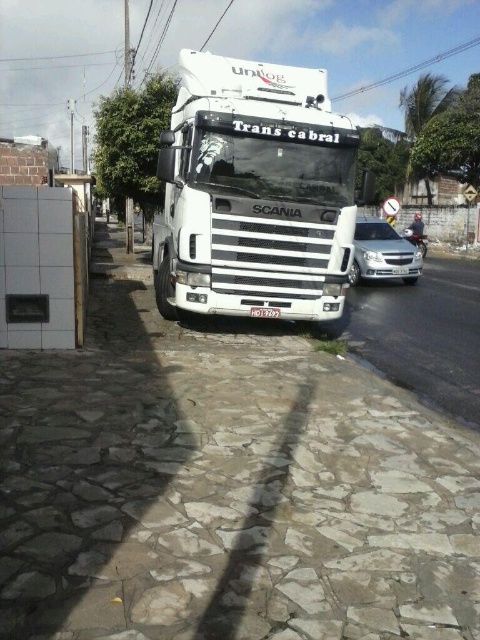
You are standing on the cobblestone sidewalk on the left side of the street. You want to cross the street to the paved road on the right. Is the white matte truck at center blocking your path directly in front of you?

The white matte truck at center is located at point (253,193), which means it is positioned in the foreground and directly in front of you on the street. Therefore, it is blocking your path directly in front of you.

You are a delivery driver who needs to park your 6.5 meter long truck behind the white matte truck at center. Is there enough space between your truck and the silver car behind it?

The distance between the white matte truck at center and the silver car behind it is 7.33 meters. Since your truck is 6.5 meters long, there is sufficient space to park your truck behind the white matte truck at center.

You are standing at the camera position looking at the street scene. Where is the white matte truck at center located in relation to the point marked at coordinates (x=253, y=193)?

The white matte truck at center is located exactly at the point marked at coordinates (x=253, y=193).